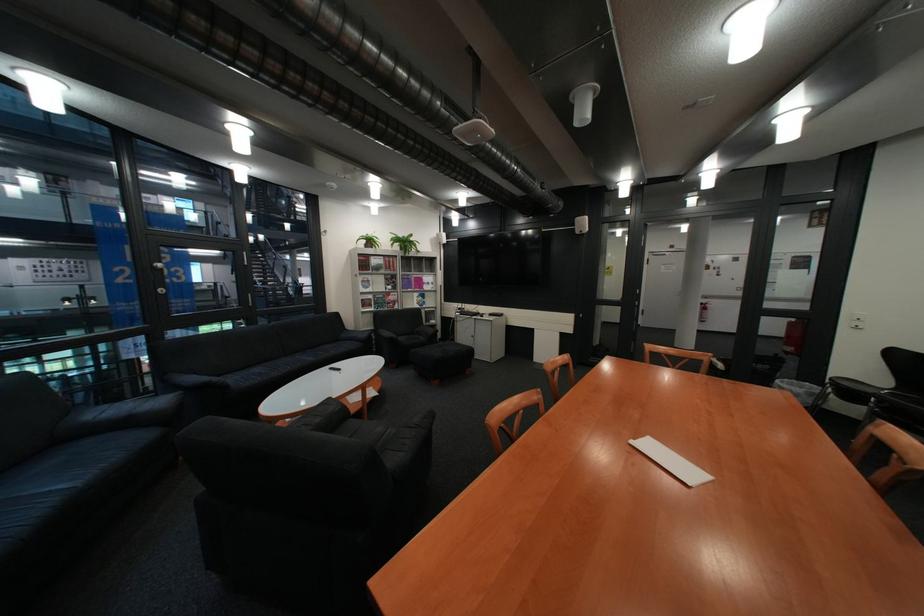
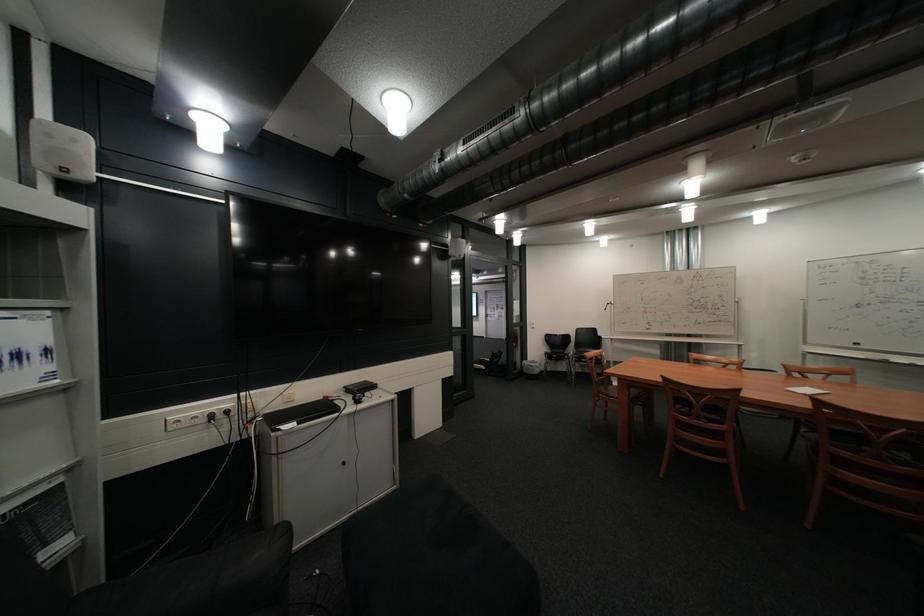
Locate, in the second image, the point that corresponds to point (444, 290) in the first image.

(46, 386)